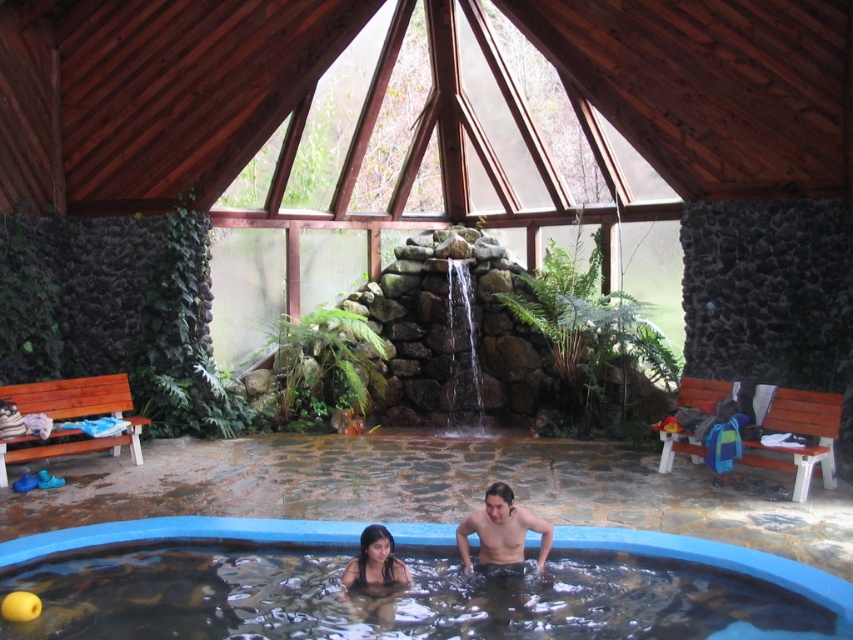
From the picture: Is smooth skin man at center to the right of smooth black hair at lower center from the viewer's perspective?

Indeed, smooth skin man at center is positioned on the right side of smooth black hair at lower center.

Between smooth skin man at center and smooth black hair at lower center, which one is positioned lower?

smooth black hair at lower center is lower down.

This screenshot has width=853, height=640. I want to click on smooth skin man at center, so click(502, 531).

Between point (341, 596) and point (387, 563), which one is positioned behind?

Point (341, 596)

Is point (316, 620) farther from camera compared to point (370, 540)?

No, it is in front of (370, 540).

What do you see at coordinates (407, 588) in the screenshot?
I see `blue smooth pool at center` at bounding box center [407, 588].

The image size is (853, 640). I want to click on blue smooth pool at center, so click(407, 588).

Does point (140, 554) come behind point (511, 499)?

Yes, point (140, 554) is farther from viewer.

Consider the image. Can you confirm if blue smooth pool at center is bigger than smooth skin man at center?

Correct, blue smooth pool at center is larger in size than smooth skin man at center.

This screenshot has width=853, height=640. What are the coordinates of `blue smooth pool at center` in the screenshot? It's located at (407, 588).